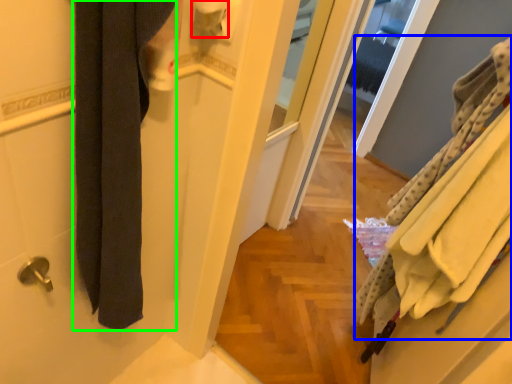
Question: Based on their relative distances, which object is farther from toilet paper (highlighted by a red box)? Choose from bath towel (highlighted by a blue box) and bath towel (highlighted by a green box).

Choices:
 (A) bath towel
 (B) bath towel

Answer: (A)